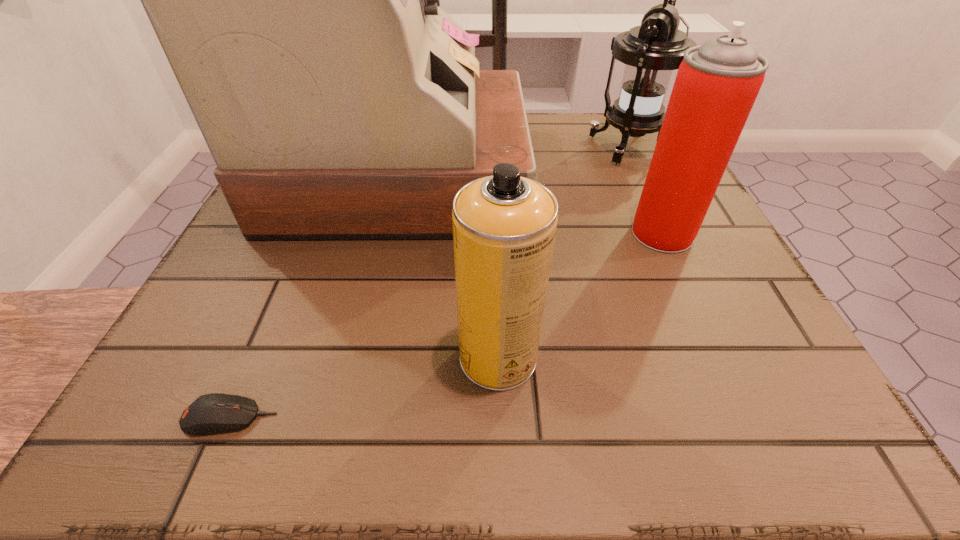
Where is `object positioned at the far left corner`? Image resolution: width=960 pixels, height=540 pixels. object positioned at the far left corner is located at coordinates (297, 0).

Where is `object present at the near left corner`? The height and width of the screenshot is (540, 960). object present at the near left corner is located at coordinates (212, 413).

Find the location of a particular element. object located at the far right corner is located at coordinates (651, 51).

The image size is (960, 540). I want to click on vacant space at the far edge, so pyautogui.click(x=584, y=119).

I want to click on vacant region at the near edge of the desktop, so click(x=558, y=381).

In the image, there is a desktop. Identify the location of vacant space at the left edge. (232, 253).

The width and height of the screenshot is (960, 540). In the image, there is a desktop. In order to click on free space at the right edge in this screenshot , I will do `click(706, 239)`.

The width and height of the screenshot is (960, 540). Identify the location of free space between the nearer aerosol can and the computer mouse. (364, 388).

The width and height of the screenshot is (960, 540). Identify the location of vacant region between the nearer aerosol can and the lantern. (564, 252).

At what (x,y) coordinates should I click in order to perform the action: click on vacant space that's between the cash register and the nearest object. Please return your answer as a coordinate pair (x, y). Looking at the image, I should click on (316, 296).